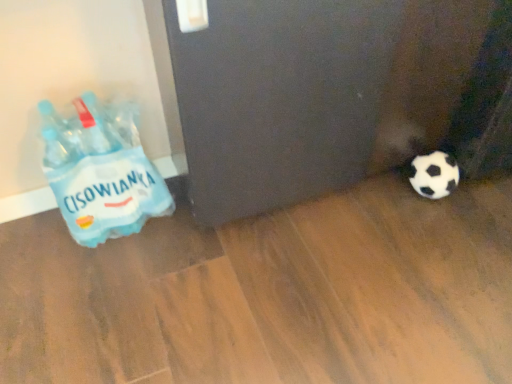
This screenshot has height=384, width=512. I want to click on free point in front of blue plastic bottle at left, so click(106, 282).